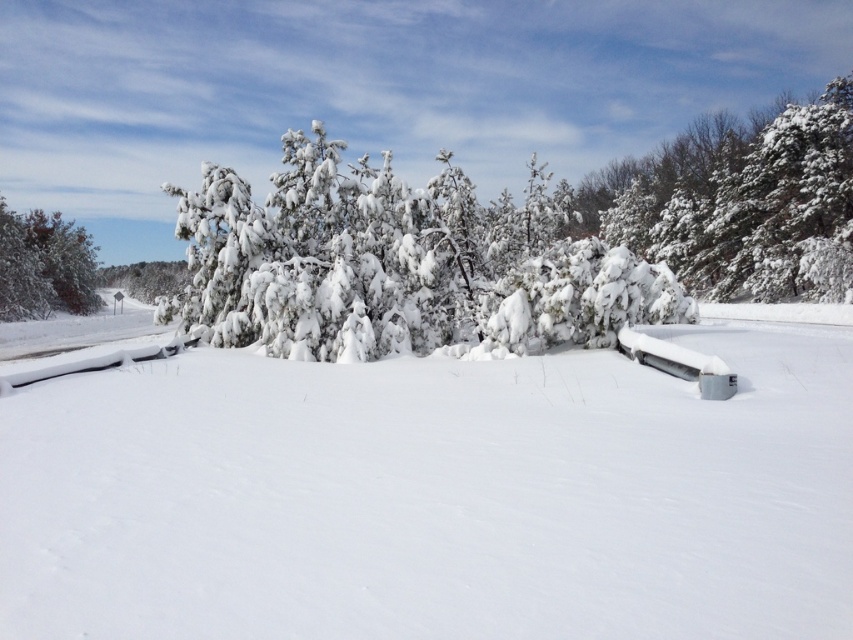
You are standing in the winter landscape and want to walk towards the two points marked in the image. Which point, point (x=613, y=577) or point (x=689, y=243), will you reach first?

Point (x=613, y=577) is closer to the viewer than point (x=689, y=243), so you will reach point (x=613, y=577) first.